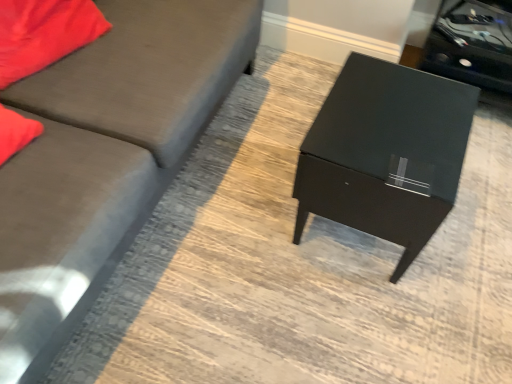
Question: Considering the positions of black glossy side table at upper right and matte black table at center in the image, is black glossy side table at upper right bigger or smaller than matte black table at center?

Choices:
 (A) small
 (B) big

Answer: (A)

Question: From a real-world perspective, is black glossy side table at upper right positioned above or below matte black table at center?

Choices:
 (A) above
 (B) below

Answer: (B)

Question: Based on their relative distances, which object is farther from the matte gray couch at left?

Choices:
 (A) black glossy side table at upper right
 (B) matte black table at center
 (C) matte red pillow at upper left

Answer: (A)

Question: Based on their relative distances, which object is farther from the matte gray couch at left?

Choices:
 (A) black glossy side table at upper right
 (B) matte black table at center
 (C) matte red pillow at upper left

Answer: (A)